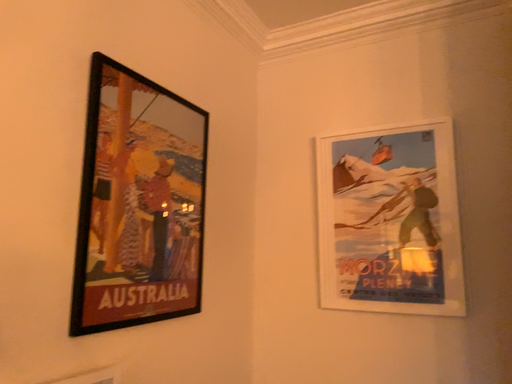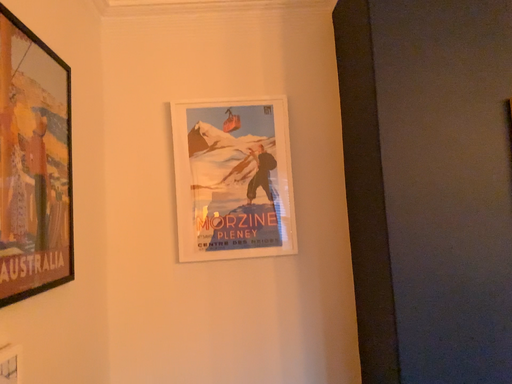
Question: How did the camera likely rotate when shooting the video?

Choices:
 (A) rotated left
 (B) rotated right

Answer: (B)